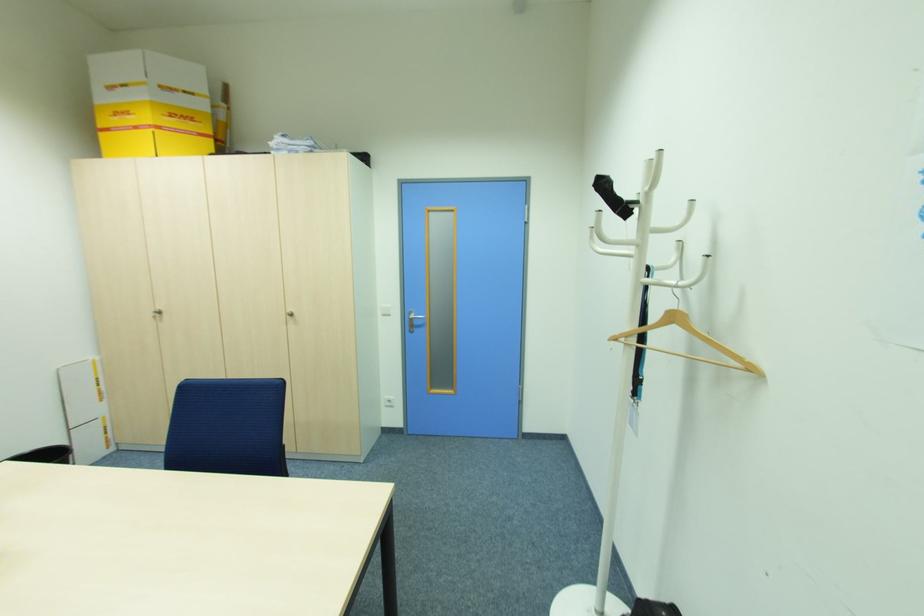
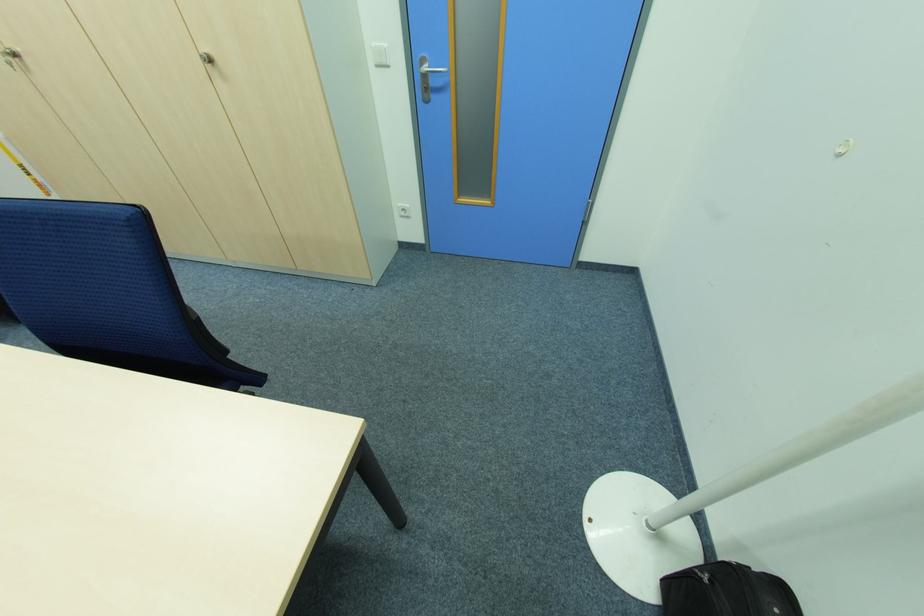
The point at (162, 312) is marked in the first image. Where is the corresponding point in the second image?

(18, 55)